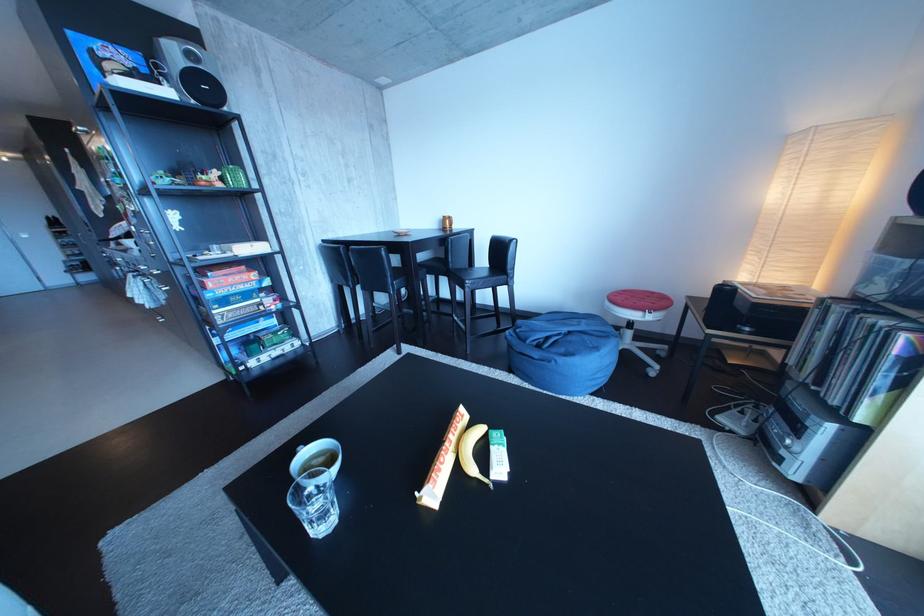
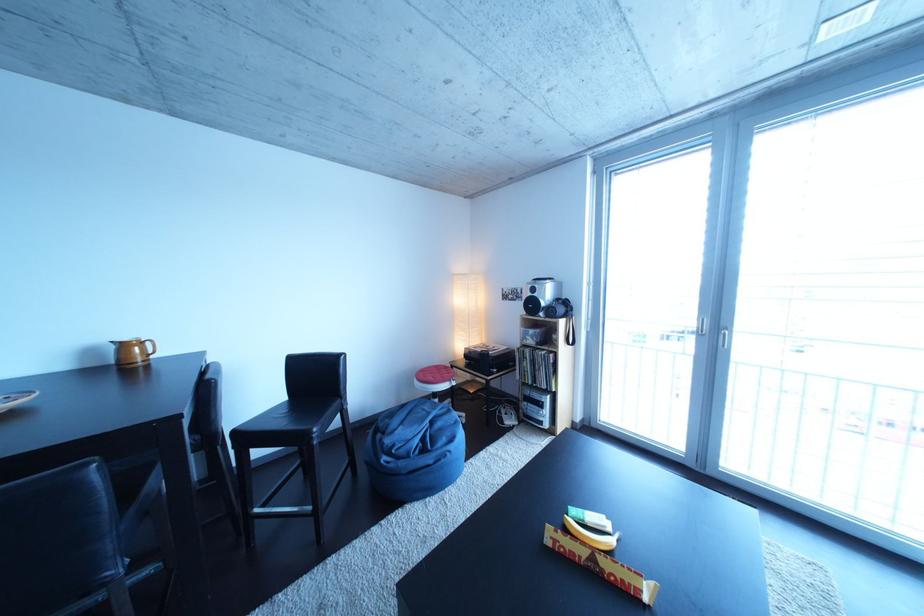
Where in the second image is the point corresponding to (582,339) from the first image?

(444, 428)